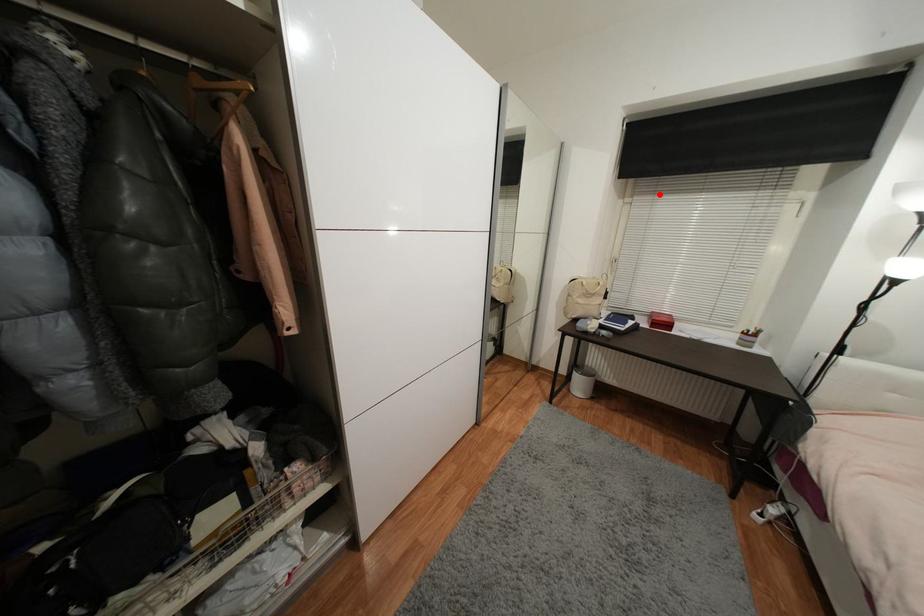
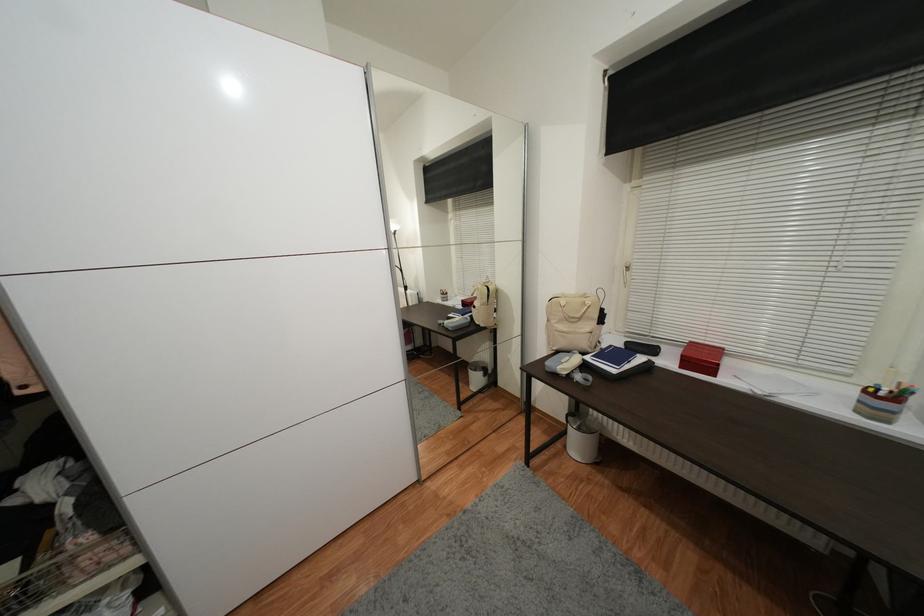
In the second image, find the point that corresponds to the highlighted location in the first image.

(678, 167)